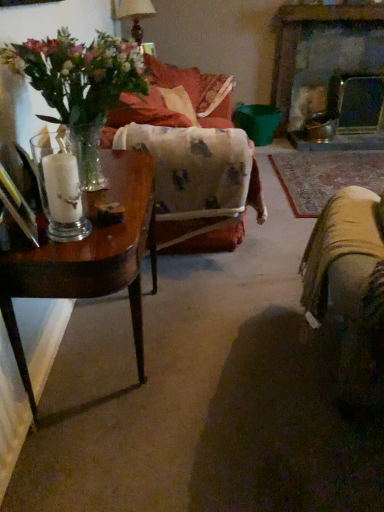
Where is `vacant space underneath translucent glass vase at left (from a real-world perspective)`? vacant space underneath translucent glass vase at left (from a real-world perspective) is located at coordinates (123, 177).